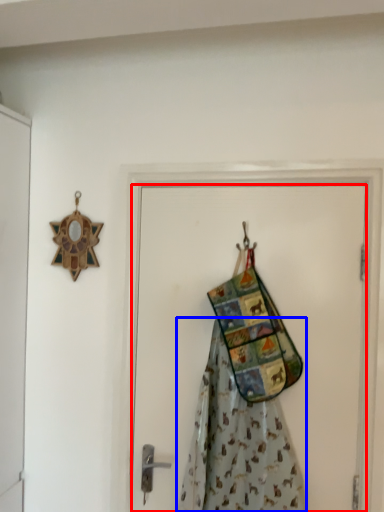
Question: Which object is closer to the camera taking this photo, door (highlighted by a red box) or fancy dress (highlighted by a blue box)?

Choices:
 (A) door
 (B) fancy dress

Answer: (B)